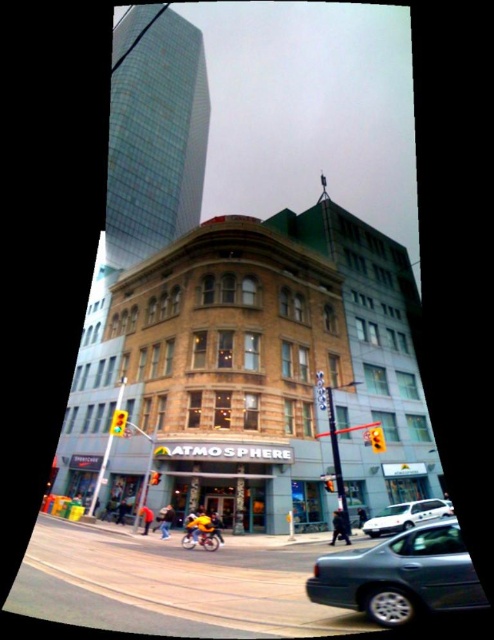
Question: Considering the real-world distances, which object is closest to the metallic silver car at lower right?

Choices:
 (A) metallic gray sedan at lower right
 (B) white matte car at lower right

Answer: (A)

Question: Does metallic gray sedan at lower right have a smaller size compared to white matte car at lower right?

Choices:
 (A) yes
 (B) no

Answer: (B)

Question: Which point is farther from the camera taking this photo?

Choices:
 (A) (398, 506)
 (B) (374, 608)

Answer: (A)

Question: Is metallic silver car at lower right above metallic gray sedan at lower right?

Choices:
 (A) no
 (B) yes

Answer: (A)

Question: In this image, where is metallic silver car at lower right located relative to white matte car at lower right?

Choices:
 (A) below
 (B) above

Answer: (B)

Question: Which of the following is the farthest from the observer?

Choices:
 (A) white matte car at lower right
 (B) metallic gray sedan at lower right
 (C) metallic silver car at lower right

Answer: (A)